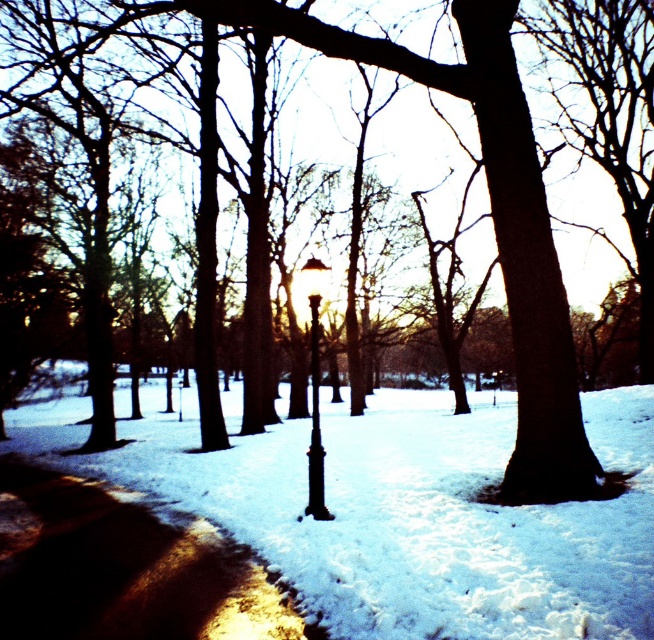
Question: Is shiny brass lamp post at center smaller than black metal pole at center?

Choices:
 (A) no
 (B) yes

Answer: (A)

Question: Observing the image, what is the correct spatial positioning of white fluffy snow at center in reference to shiny asphalt pavement at lower left?

Choices:
 (A) right
 (B) left

Answer: (B)

Question: Based on their relative distances, which object is nearer to the shiny asphalt pavement at lower left?

Choices:
 (A) shiny brass lamp post at center
 (B) white fluffy snow at center
 (C) black metal pole at center

Answer: (C)

Question: Which object is farther from the camera taking this photo?

Choices:
 (A) shiny asphalt pavement at lower left
 (B) black metal pole at center
 (C) white fluffy snow at center
 (D) shiny brass lamp post at center

Answer: (B)

Question: Among these points, which one is nearest to the camera?

Choices:
 (A) (213, 557)
 (B) (426, 572)
 (C) (322, 266)

Answer: (B)

Question: Is white fluffy snow at center closer to the viewer compared to shiny asphalt pavement at lower left?

Choices:
 (A) no
 (B) yes

Answer: (B)